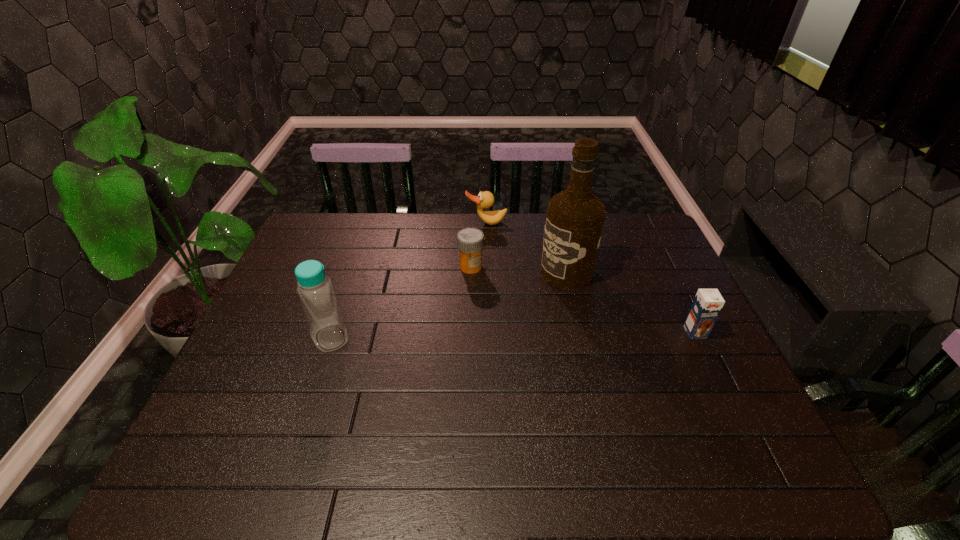
You are a GUI agent. You are given a task and a screenshot of the screen. Output one action in this format:
    pyautogui.click(x=<x>, y=<y>)
    Task: Click on the vacant space on the desktop that is between the leftmost object and the rightmost object and is positioned on the label of the tallest object
    
    Given the screenshot: What is the action you would take?
    pyautogui.click(x=460, y=336)

Identify the location of free space on the desktop that is between the second tallest object and the rightmost object and is positioned on the beak of the duck. (509, 335).

Identify the location of vacant space on the desktop that is between the leftmost object and the chocolate milk and is positioned on the label side of the medicine. (467, 336).